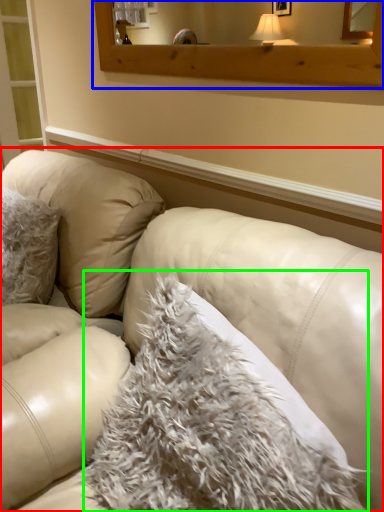
Question: Which object is the farthest from studio couch (highlighted by a red box)? Choose among these: window frame (highlighted by a blue box) or blanket (highlighted by a green box).

Choices:
 (A) window frame
 (B) blanket

Answer: (A)